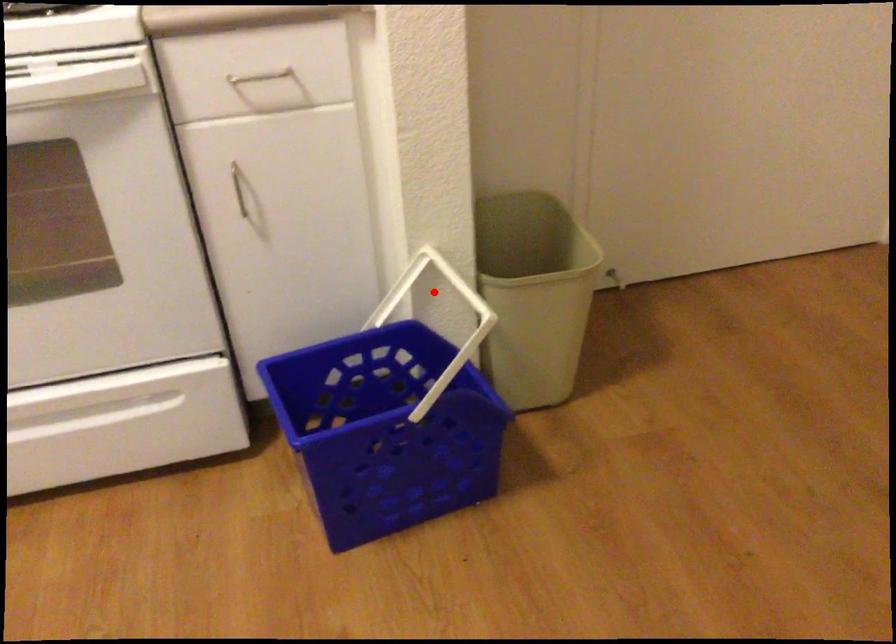
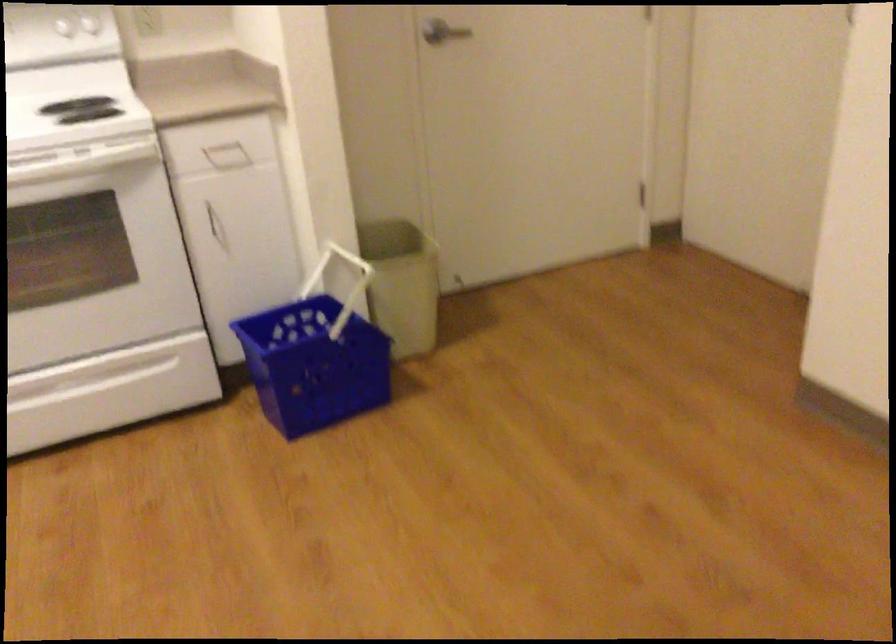
Where in the second image is the point corresponding to the highlighted location from the first image?

(337, 272)